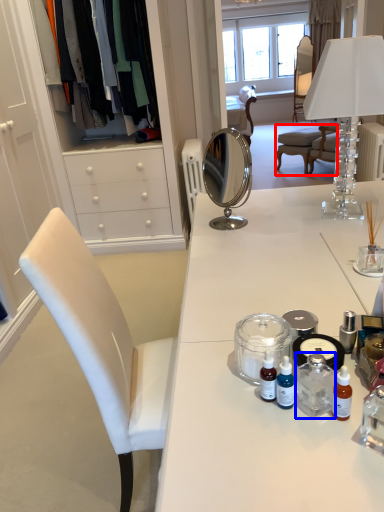
Question: Which object appears farthest to the camera in this image, chair (highlighted by a red box) or bottle (highlighted by a blue box)?

Choices:
 (A) chair
 (B) bottle

Answer: (A)